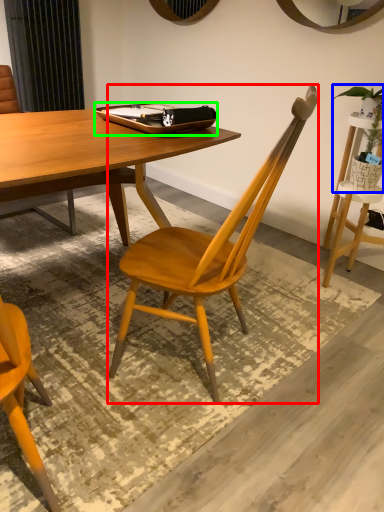
Question: Based on their relative distances, which object is nearer to chair (highlighted by a red box)? Choose from houseplant (highlighted by a blue box) and tray (highlighted by a green box).

Choices:
 (A) houseplant
 (B) tray

Answer: (B)